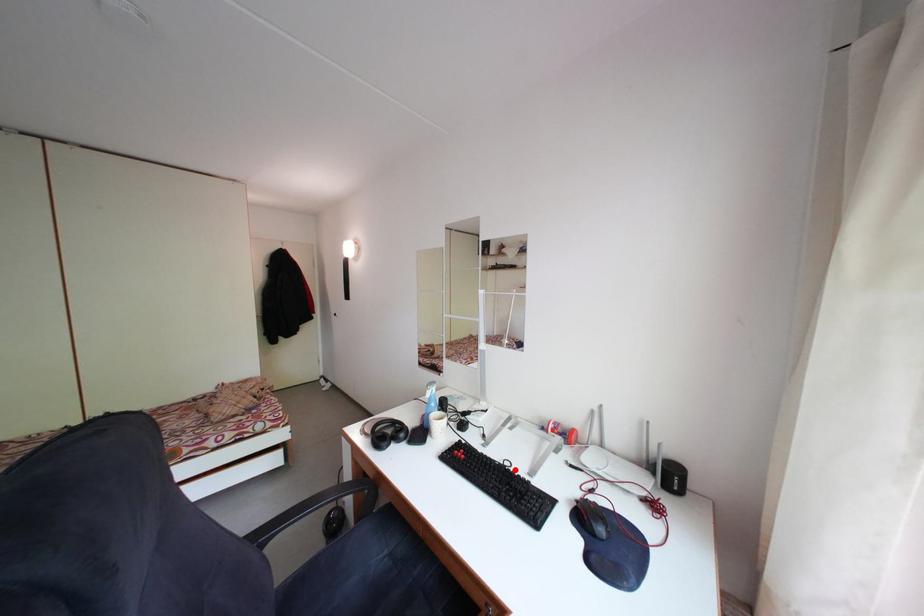
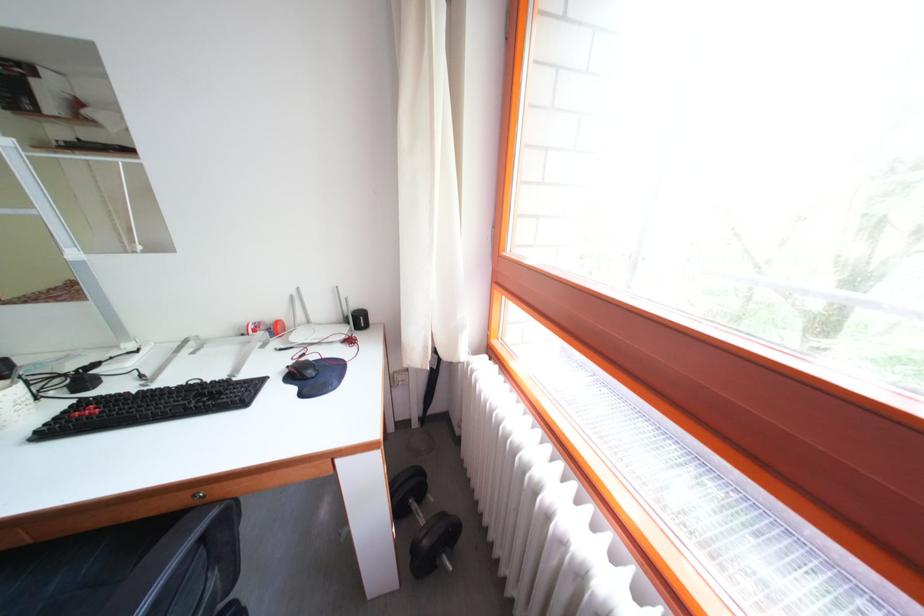
Locate, in the second image, the point that corresponds to the highlighted location in the first image.

(201, 389)